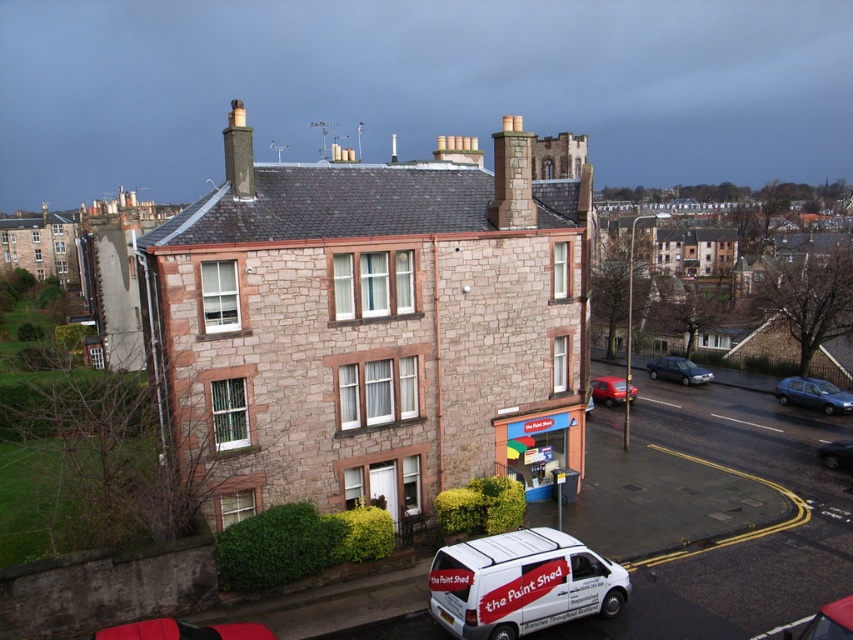
Question: Which object is the farthest from the dark blue metallic sedan at center-right?

Choices:
 (A) metallic blue sedan at lower right
 (B) stone chimney at center

Answer: (B)

Question: Based on their relative distances, which object is farther from the dark gray stone chimney at upper center?

Choices:
 (A) white matte van at lower center
 (B) metallic blue sedan at lower right
 (C) metallic red car at lower left
 (D) stone chimney at center

Answer: (B)

Question: Among these objects, which one is farthest from the camera?

Choices:
 (A) dark blue metallic sedan at center-right
 (B) stone chimney at center
 (C) dark gray stone chimney at upper center

Answer: (A)

Question: Does white matte van at lower center appear over dark gray stone chimney at upper center?

Choices:
 (A) no
 (B) yes

Answer: (A)

Question: Does metallic red car at lower left come behind matte red car at lower right?

Choices:
 (A) yes
 (B) no

Answer: (B)

Question: Does white matte van at lower center have a lesser width compared to metallic blue sedan at lower right?

Choices:
 (A) no
 (B) yes

Answer: (A)